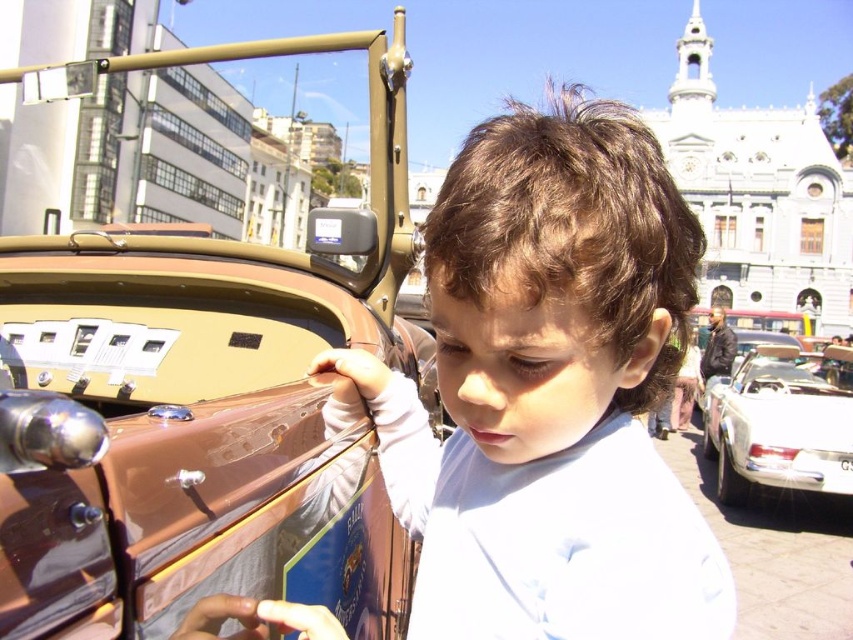
The height and width of the screenshot is (640, 853). What do you see at coordinates (206, 403) in the screenshot?
I see `shiny brown car door at center` at bounding box center [206, 403].

Does shiny brown car door at center appear under matte brown hair at center?

Incorrect, shiny brown car door at center is not positioned below matte brown hair at center.

Does point (296, 512) come behind point (483, 627)?

Yes.

Identify the location of shiny brown car door at center. (206, 403).

Which is below, matte brown hair at center or white glossy car at right?

Positioned lower is white glossy car at right.

Image resolution: width=853 pixels, height=640 pixels. Describe the element at coordinates (550, 392) in the screenshot. I see `matte brown hair at center` at that location.

In order to click on matte brown hair at center in this screenshot , I will do [550, 392].

Does shiny brown car door at center appear over white glossy car at right?

Correct, shiny brown car door at center is located above white glossy car at right.

Is shiny brown car door at center closer to the viewer compared to white glossy car at right?

Yes.

From the picture: Measure the distance between shiny brown car door at center and camera.

shiny brown car door at center is 185.69 feet away from camera.

Locate an element on the screen. shiny brown car door at center is located at coordinates (206, 403).